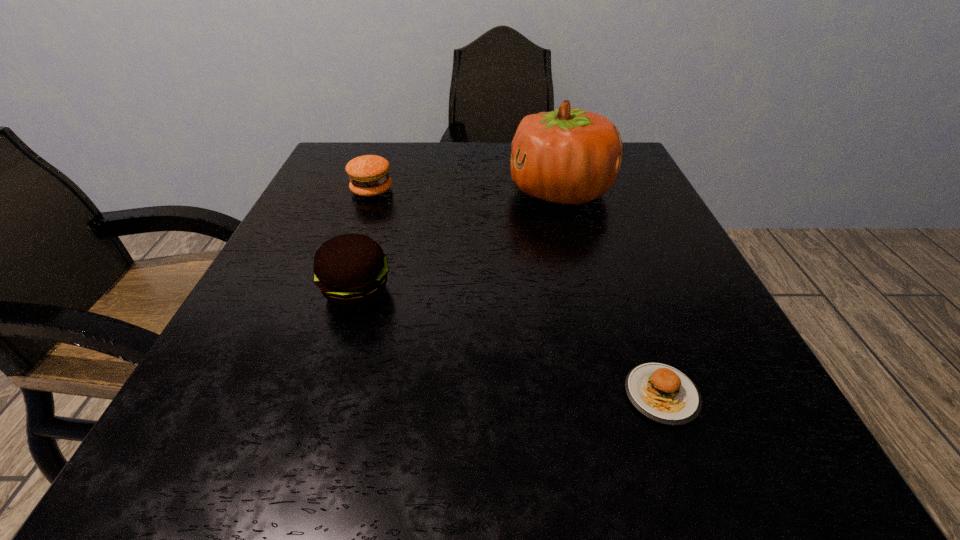
You are a GUI agent. You are given a task and a screenshot of the screen. Output one action in this format:
    pyautogui.click(x=<x>, y=<y>)
    Task: Click on the free spot between the nearest object and the second farthest food
    This screenshot has height=540, width=960.
    Given the screenshot: What is the action you would take?
    pyautogui.click(x=509, y=343)

Find the location of a particular element. Image resolution: width=960 pixels, height=540 pixels. empty space between the third farthest object and the tallest object is located at coordinates (458, 241).

Where is `free space between the nearest food and the second tallest food`? The image size is (960, 540). free space between the nearest food and the second tallest food is located at coordinates (516, 293).

Identify the location of free point between the third tallest object and the shortest object. (516, 293).

Identify the location of vacant point located between the tallest food and the tallest object. (458, 241).

The width and height of the screenshot is (960, 540). I want to click on the closest object to the shortest object, so click(351, 270).

Locate an element on the screen. The height and width of the screenshot is (540, 960). object that stands as the third closest to the third farthest object is located at coordinates (662, 393).

You are a GUI agent. You are given a task and a screenshot of the screen. Output one action in this format:
    pyautogui.click(x=<x>, y=<y>)
    Task: Click on the food that can be found as the closest to the pumpkin
    
    Given the screenshot: What is the action you would take?
    pyautogui.click(x=368, y=174)

Identify the location of the second closest food relative to the second tallest object. (662, 393).

Find the location of a particular element. This screenshot has height=540, width=960. vacant region that satisfies the following two spatial constraints: 1. on the side of the pumpkin with the cute face; 2. on the right side of the nearest object is located at coordinates (614, 395).